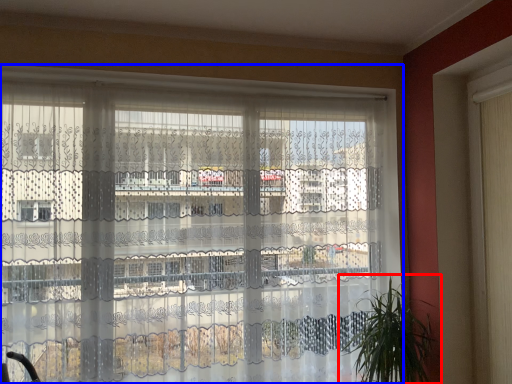
Question: Which object appears farthest to the camera in this image, houseplant (highlighted by a red box) or window (highlighted by a blue box)?

Choices:
 (A) houseplant
 (B) window

Answer: (A)